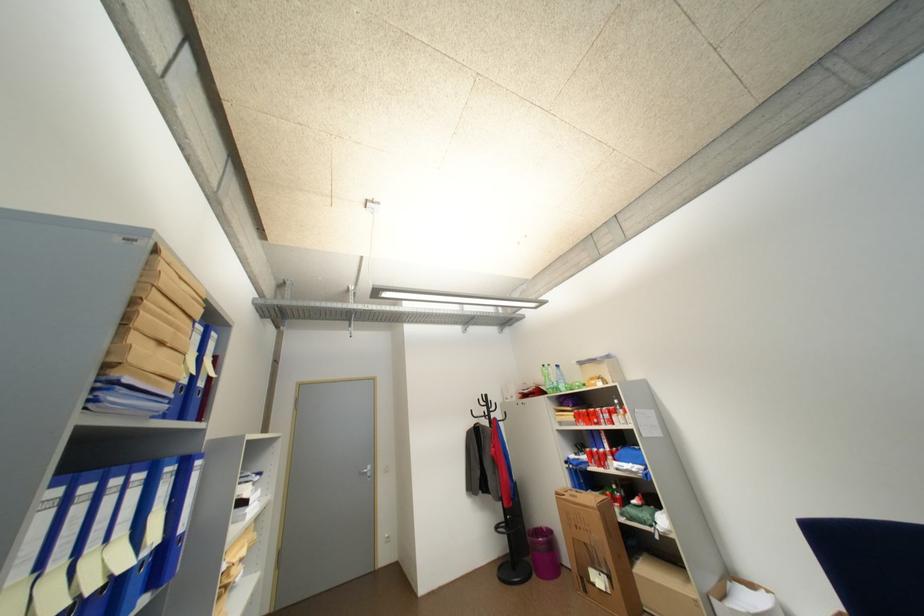
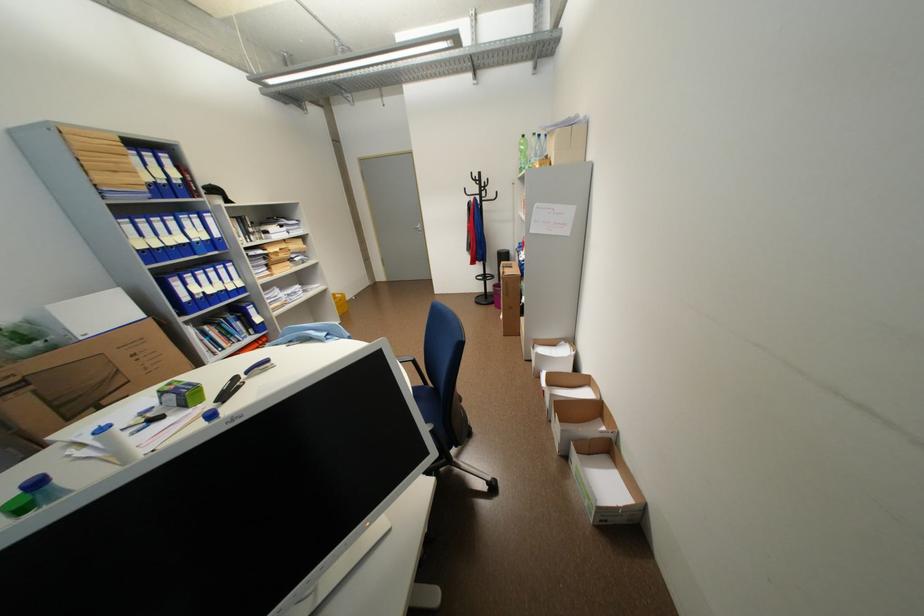
Find the pixel in the second image that matches (552,367) in the first image.

(531, 137)